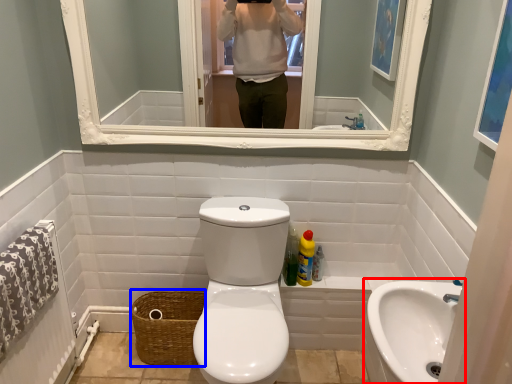
Question: Which point is closer to the camera, sink (highlighted by a red box) or basket (highlighted by a blue box)?

Choices:
 (A) sink
 (B) basket

Answer: (A)